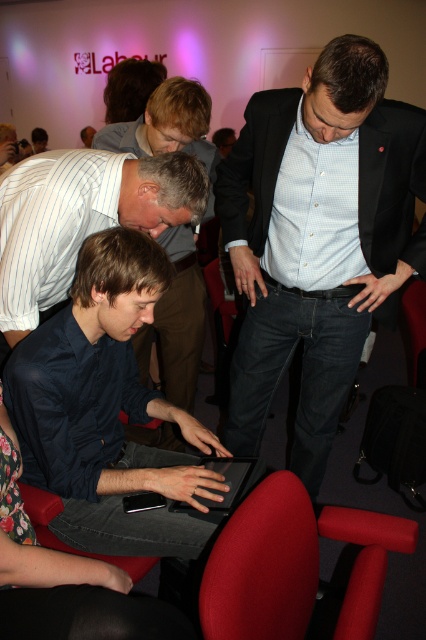
You are an event planner arranging seating for a presentation. You need to place a name tag on the velvet red chair at lower center. Where should you place it so that it is visible to the matte black suit at center?

The name tag should be placed on the velvet red chair at lower center in a position facing upwards so that the matte black suit at center can see it from above.

You are a photographer in the room and want to take a photo of the dark blue shirt at center and the black matte tablet at center. Which object should you focus on first if you want to capture both clearly in the same frame?

The dark blue shirt at center is much taller than the black matte tablet at center, so you should focus on the dark blue shirt at center first to ensure both are in focus.